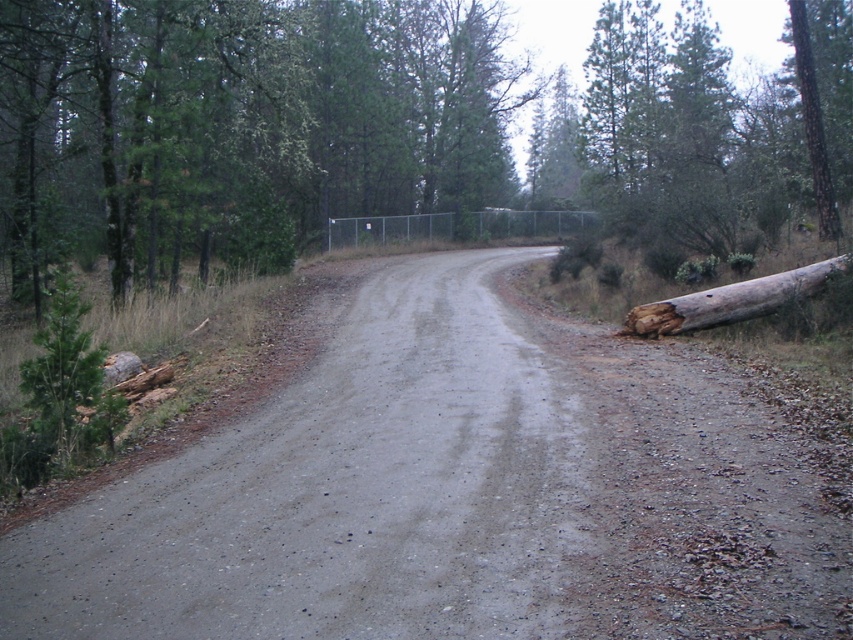
Question: Which object appears farthest from the camera in this image?

Choices:
 (A) brown rough tree trunk at upper right
 (B) brown wood log at right
 (C) gray gravel road at center

Answer: (A)

Question: Which object is the farthest from the brown rough tree trunk at upper right?

Choices:
 (A) brown rough log at right
 (B) gray gravel road at center
 (C) brown wood log at right

Answer: (C)

Question: Which of the following is the closest to the observer?

Choices:
 (A) brown rough log at right
 (B) brown wood log at right
 (C) gray gravel road at center

Answer: (C)

Question: Is gray gravel road at center bigger than brown wood log at right?

Choices:
 (A) yes
 (B) no

Answer: (B)

Question: Does brown rough log at right appear on the left side of brown rough tree trunk at upper right?

Choices:
 (A) no
 (B) yes

Answer: (B)

Question: Is brown rough log at right bigger than brown rough tree trunk at upper right?

Choices:
 (A) yes
 (B) no

Answer: (B)